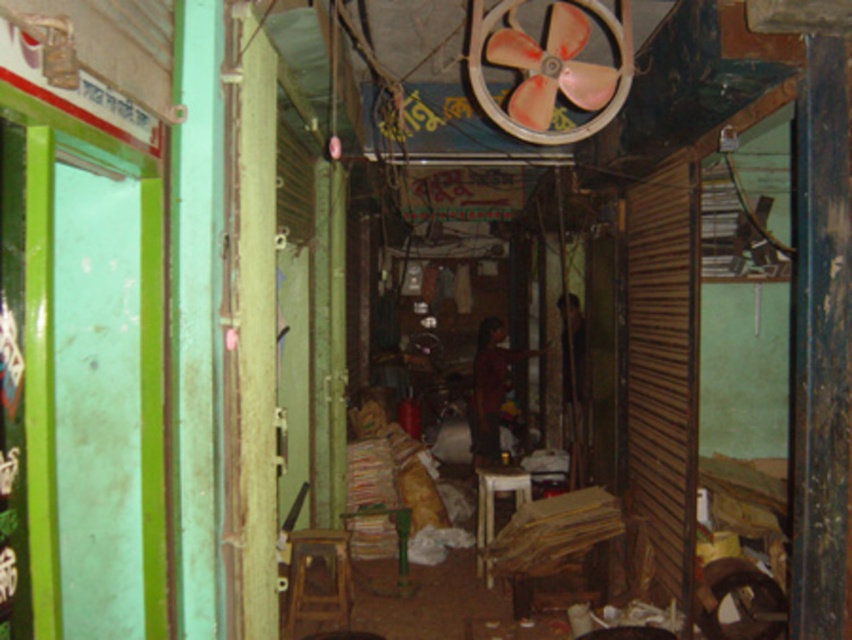
Question: Is pink plastic fan at upper center below wooden stool at center?

Choices:
 (A) no
 (B) yes

Answer: (A)

Question: Among these points, which one is farthest from the camera?

Choices:
 (A) (547, 90)
 (B) (297, 561)

Answer: (B)

Question: Which of the following is the closest to the observer?

Choices:
 (A) wooden stool at center
 (B) pink plastic fan at upper center

Answer: (B)

Question: Does pink plastic fan at upper center lie behind wooden stool at center?

Choices:
 (A) yes
 (B) no

Answer: (B)

Question: Does pink plastic fan at upper center have a larger size compared to wooden stool at center?

Choices:
 (A) yes
 (B) no

Answer: (A)